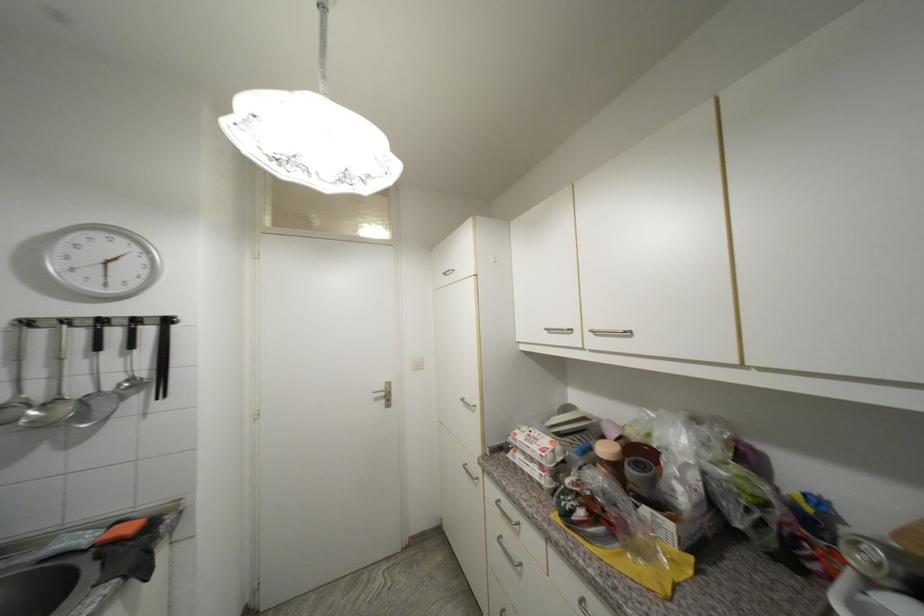
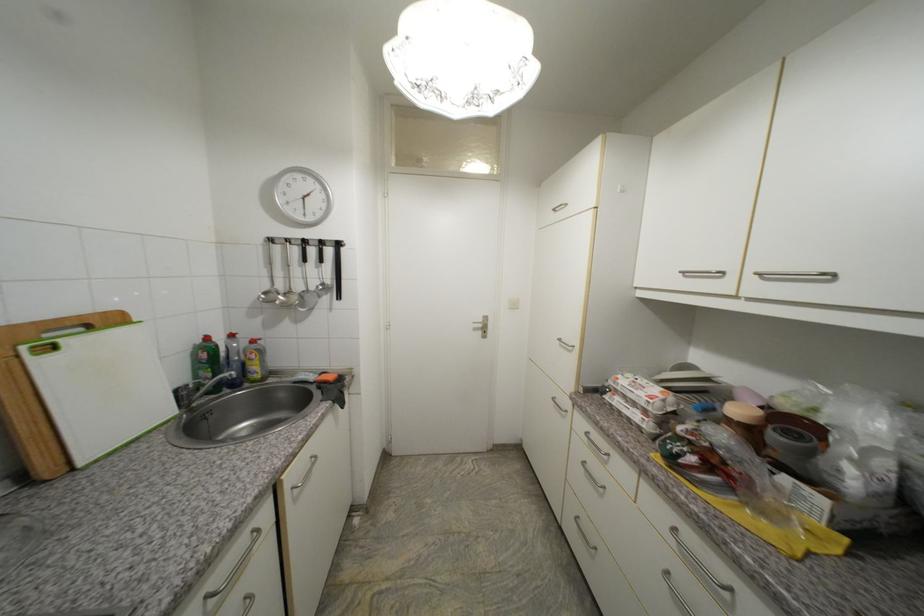
Where in the second image is the point corresponding to (388,390) from the first image?

(487, 322)